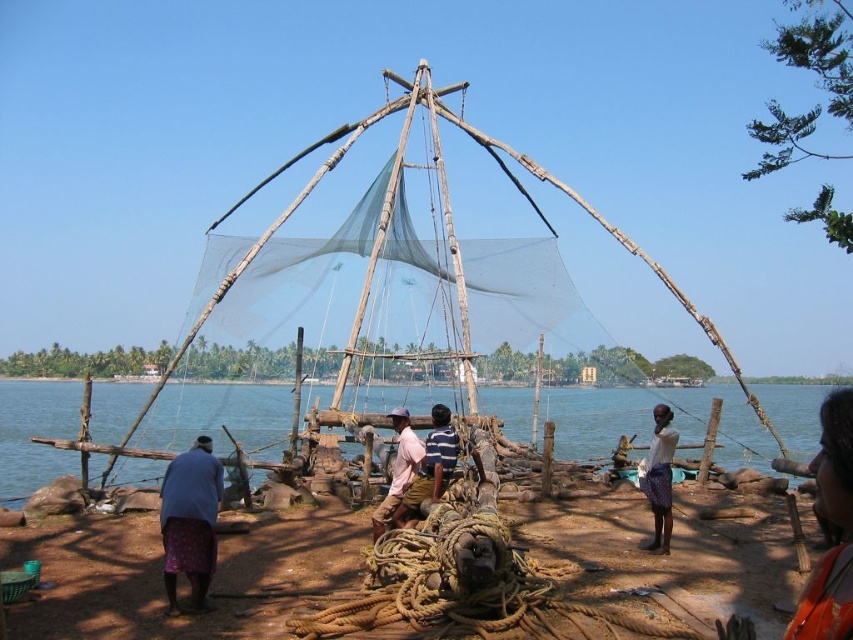
Question: Which of the following is the closest to the observer?

Choices:
 (A) dark purple fabric at center
 (B) transparent water at center
 (C) striped fabric shirt at center

Answer: (C)

Question: Does orange fabric at lower right appear on the left side of light pink fabric at center?

Choices:
 (A) no
 (B) yes

Answer: (A)

Question: Among these points, which one is nearest to the camera?

Choices:
 (A) (393, 492)
 (B) (45, 454)
 (C) (178, 556)

Answer: (C)

Question: Does orange fabric at lower right have a smaller size compared to light pink fabric at center?

Choices:
 (A) no
 (B) yes

Answer: (A)

Question: Can you confirm if orange fabric at lower right is bigger than light pink fabric at center?

Choices:
 (A) no
 (B) yes

Answer: (B)

Question: Which object is farther from the camera taking this photo?

Choices:
 (A) transparent water at center
 (B) dark purple fabric at center

Answer: (A)